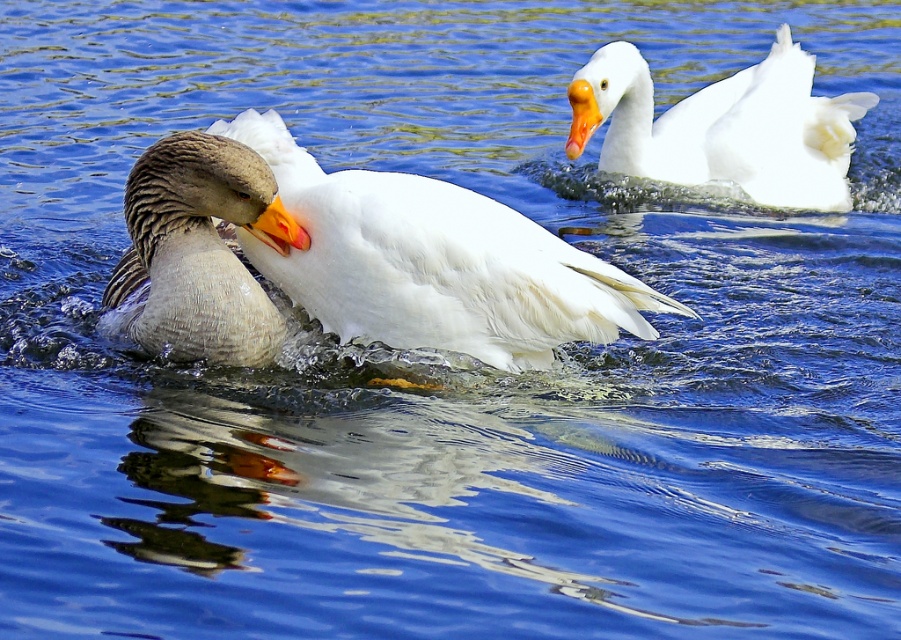
Is white feathered duck at center below orange glossy beak at upper right?

Indeed, white feathered duck at center is positioned under orange glossy beak at upper right.

Who is taller, white feathered duck at center or orange glossy beak at upper right?

white feathered duck at center is taller.

Is point (341, 216) closer to camera compared to point (595, 106)?

Yes, point (341, 216) is in front of point (595, 106).

This screenshot has width=901, height=640. Find the location of `white feathered duck at center`. white feathered duck at center is located at coordinates (434, 262).

Which is more to the right, white feathered duck at center or orange matte beak at center?

Positioned to the right is white feathered duck at center.

Does white feathered duck at center have a lesser width compared to orange matte beak at center?

In fact, white feathered duck at center might be wider than orange matte beak at center.

Does point (283, 138) come closer to viewer compared to point (278, 225)?

No, it is behind (278, 225).

Image resolution: width=901 pixels, height=640 pixels. I want to click on white feathered duck at center, so click(434, 262).

Does white matte duck at upper right appear on the left side of orange matte beak at center?

Incorrect, white matte duck at upper right is not on the left side of orange matte beak at center.

Does white matte duck at upper right have a lesser height compared to orange matte beak at center?

No.

Describe the element at coordinates (724, 125) in the screenshot. Image resolution: width=901 pixels, height=640 pixels. I see `white matte duck at upper right` at that location.

Find the location of a particular element. Image resolution: width=901 pixels, height=640 pixels. white matte duck at upper right is located at coordinates (724, 125).